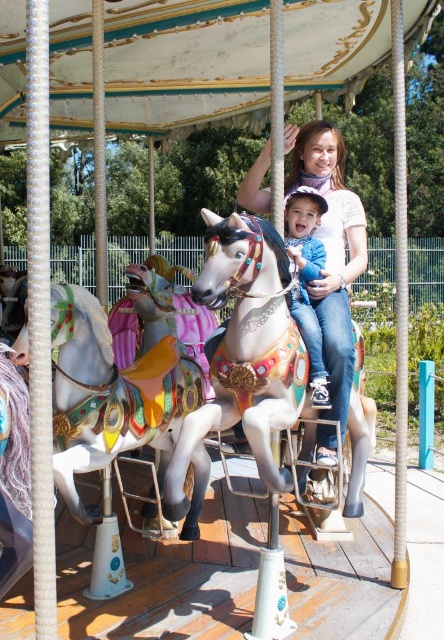
Based on the photo, does polished silver horse at center appear under matte white shirt at center?

Indeed, polished silver horse at center is positioned under matte white shirt at center.

Is point (224, 406) positioned behind point (330, 388)?

No, (224, 406) is closer to viewer.

Find the location of `polished silver horse at center`. polished silver horse at center is located at coordinates [x=252, y=339].

Does shiny metallic horse at center have a lesser width compared to polished silver horse at center?

In fact, shiny metallic horse at center might be wider than polished silver horse at center.

Between shiny metallic horse at center and polished silver horse at center, which one is positioned lower?

shiny metallic horse at center is lower down.

The height and width of the screenshot is (640, 444). Describe the element at coordinates (117, 381) in the screenshot. I see `shiny metallic horse at center` at that location.

At what (x,y) coordinates should I click in order to perform the action: click on shiny metallic horse at center. Please return your answer as a coordinate pair (x, y). Image resolution: width=444 pixels, height=640 pixels. Looking at the image, I should click on (117, 381).

Does polished silver horse at center come in front of blue denim jeans at center?

Yes.

The height and width of the screenshot is (640, 444). What are the coordinates of `polished silver horse at center` in the screenshot? It's located at (252, 339).